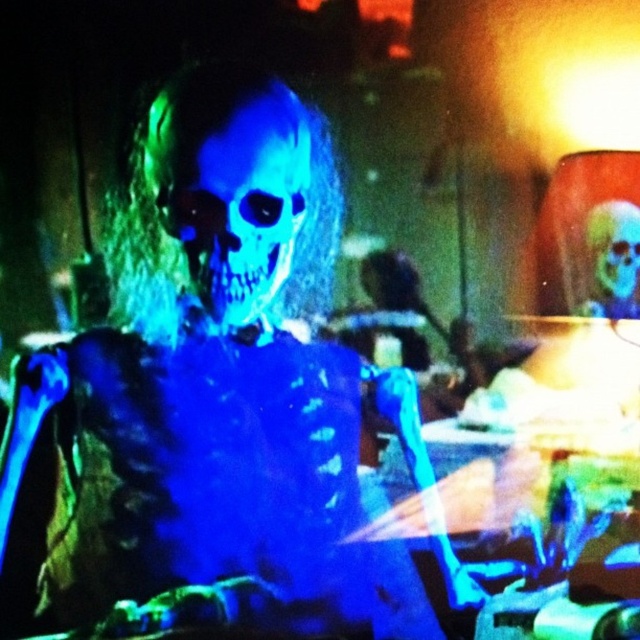
Question: Among these objects, which one is nearest to the camera?

Choices:
 (A) blue translucent skull at upper right
 (B) blue matte skull at center
 (C) translucent blue skull at center
 (D) blue translucent skeleton at center

Answer: (D)

Question: Can you confirm if blue translucent skeleton at center is positioned above blue translucent skull at upper right?

Choices:
 (A) yes
 (B) no

Answer: (B)

Question: Considering the relative positions of blue translucent skeleton at center and translucent blue skull at center in the image provided, where is blue translucent skeleton at center located with respect to translucent blue skull at center?

Choices:
 (A) right
 (B) left

Answer: (B)

Question: Which object is the farthest from the blue translucent skull at upper right?

Choices:
 (A) translucent blue skull at center
 (B) blue matte skull at center
 (C) blue translucent skeleton at center

Answer: (C)

Question: Does blue translucent skeleton at center have a lesser width compared to translucent blue skull at center?

Choices:
 (A) no
 (B) yes

Answer: (A)

Question: Which of the following is the farthest from the observer?

Choices:
 (A) (621, 250)
 (B) (624, 218)
 (C) (218, 312)

Answer: (A)